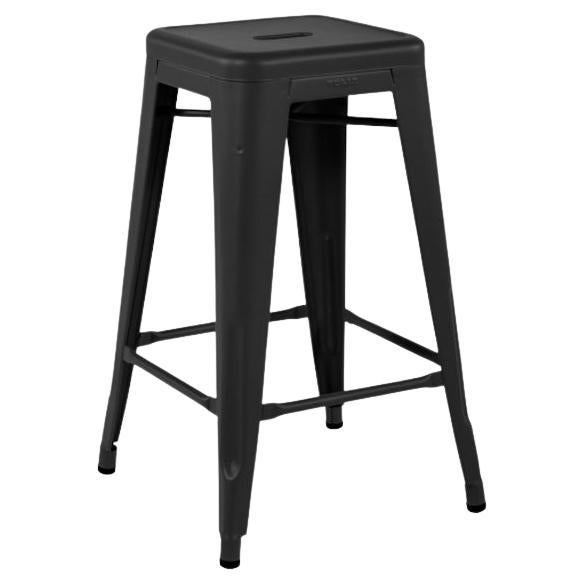
You are a GUI agent. You are given a task and a screenshot of the screen. Output one action in this format:
    pyautogui.click(x=<x>, y=<y>)
    Task: Click on the oval opening on stool seat
    Image resolution: width=584 pixels, height=584 pixels.
    Given the screenshot: What is the action you would take?
    pyautogui.click(x=293, y=36)